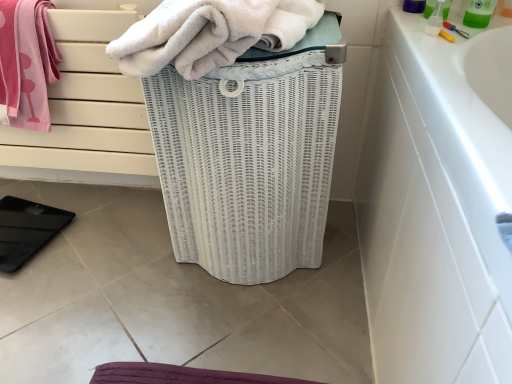
Question: Does green plastic bottle at upper right appear on the right side of pink cotton towel at upper left, which is the 1th towel in left-to-right order?

Choices:
 (A) no
 (B) yes

Answer: (B)

Question: Can you confirm if green plastic bottle at upper right is wider than pink cotton towel at upper left, which is the 1th towel in left-to-right order?

Choices:
 (A) no
 (B) yes

Answer: (A)

Question: Is green plastic bottle at upper right taller than pink cotton towel at upper left, which is the 1th towel in left-to-right order?

Choices:
 (A) no
 (B) yes

Answer: (A)

Question: Is green plastic bottle at upper right outside pink cotton towel at upper left, which is the 1th towel in left-to-right order?

Choices:
 (A) no
 (B) yes

Answer: (B)

Question: Is pink cotton towel at upper left, which is the 1th towel in left-to-right order, surrounded by green plastic bottle at upper right?

Choices:
 (A) yes
 (B) no

Answer: (B)

Question: In terms of size, does green plastic bottle at upper right appear bigger or smaller than white wicker basket at center?

Choices:
 (A) big
 (B) small

Answer: (B)

Question: Is green plastic bottle at upper right situated inside white wicker basket at center or outside?

Choices:
 (A) outside
 (B) inside

Answer: (A)

Question: Considering the positions of green plastic bottle at upper right and white wicker basket at center in the image, is green plastic bottle at upper right wider or thinner than white wicker basket at center?

Choices:
 (A) thin
 (B) wide

Answer: (A)

Question: In the image, is green plastic bottle at upper right positioned in front of or behind white wicker basket at center?

Choices:
 (A) behind
 (B) front

Answer: (A)

Question: Is green plastic bottle at upper right wider or thinner than white fluffy towel at center, arranged as the second towel when viewed from the left?

Choices:
 (A) wide
 (B) thin

Answer: (B)

Question: Is green plastic bottle at upper right to the left or to the right of white fluffy towel at center, arranged as the second towel when viewed from the left, in the image?

Choices:
 (A) left
 (B) right

Answer: (B)

Question: Is green plastic bottle at upper right bigger or smaller than white fluffy towel at center, which appears as the 1th towel when viewed from the right?

Choices:
 (A) big
 (B) small

Answer: (B)

Question: Considering their positions, is green plastic bottle at upper right located in front of or behind white fluffy towel at center, which appears as the 1th towel when viewed from the right?

Choices:
 (A) behind
 (B) front

Answer: (A)

Question: Considering the positions of pink cotton towel at upper left, which is the 2th towel in right-to-left order, and white fluffy towel at center, arranged as the second towel when viewed from the left, in the image, is pink cotton towel at upper left, which is the 2th towel in right-to-left order, bigger or smaller than white fluffy towel at center, arranged as the second towel when viewed from the left,?

Choices:
 (A) big
 (B) small

Answer: (B)

Question: Does point (45, 89) appear closer or farther from the camera than point (201, 56)?

Choices:
 (A) closer
 (B) farther

Answer: (B)